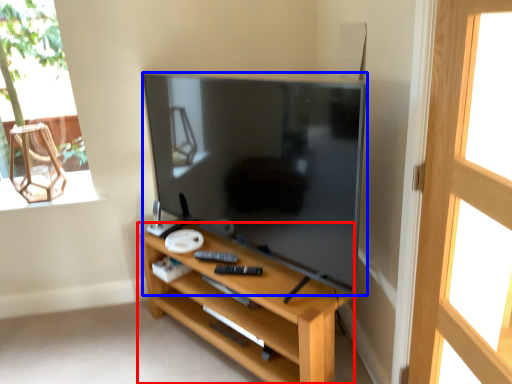
Question: Which point is further to the camera, shelf (highlighted by a red box) or television (highlighted by a blue box)?

Choices:
 (A) shelf
 (B) television

Answer: (A)